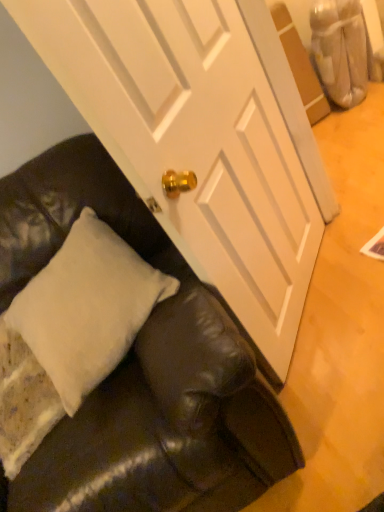
In order to face black leather couch at lower left, should I rotate leftwards or rightwards?

A 20.277 degree turn to the left will do.

Image resolution: width=384 pixels, height=512 pixels. Describe the element at coordinates (142, 368) in the screenshot. I see `black leather couch at lower left` at that location.

You are a GUI agent. You are given a task and a screenshot of the screen. Output one action in this format:
    pyautogui.click(x=<x>, y=<y>)
    Task: Click on the black leather couch at lower left
    This screenshot has height=512, width=384.
    Given the screenshot: What is the action you would take?
    pyautogui.click(x=142, y=368)

Measure the distance between point (69, 236) and camera.

A distance of 3.84 feet exists between point (69, 236) and camera.

The height and width of the screenshot is (512, 384). What do you see at coordinates (87, 308) in the screenshot?
I see `white soft pillow at lower left` at bounding box center [87, 308].

The width and height of the screenshot is (384, 512). I want to click on white soft pillow at lower left, so click(87, 308).

The height and width of the screenshot is (512, 384). Identify the location of black leather couch at lower left. 142,368.

Is black leather couch at lower left at the left side of white soft pillow at lower left?

No, black leather couch at lower left is not to the left of white soft pillow at lower left.

Considering the positions of objects black leather couch at lower left and white soft pillow at lower left in the image provided, who is in front, black leather couch at lower left or white soft pillow at lower left?

black leather couch at lower left is closer to the camera.

Which is in front, point (59, 186) or point (133, 304)?

Positioned in front is point (133, 304).

From the image's perspective, does black leather couch at lower left appear higher than white soft pillow at lower left?

No.

From a real-world perspective, is black leather couch at lower left located higher than white soft pillow at lower left?

Actually, black leather couch at lower left is physically below white soft pillow at lower left in the real world.

Between black leather couch at lower left and white soft pillow at lower left, which one has larger width?

Wider between the two is black leather couch at lower left.

Is black leather couch at lower left shorter than white soft pillow at lower left?

→ Incorrect, the height of black leather couch at lower left does not fall short of that of white soft pillow at lower left.

Who is smaller, black leather couch at lower left or white soft pillow at lower left?

Smaller between the two is white soft pillow at lower left.

Would you say black leather couch at lower left contains white soft pillow at lower left?

Yes, white soft pillow at lower left is surrounded by black leather couch at lower left.

Are black leather couch at lower left and white soft pillow at lower left far apart?

No.

Is black leather couch at lower left oriented away from white soft pillow at lower left?

Yes, black leather couch at lower left is positioned with its back facing white soft pillow at lower left.

At what (x,y) coordinates should I click in order to perform the action: click on studio couch in front of the white soft pillow at lower left. Please return your answer as a coordinate pair (x, y). Looking at the image, I should click on (142, 368).

Is white soft pillow at lower left to the left of black leather couch at lower left from the viewer's perspective?

Yes, white soft pillow at lower left is to the left of black leather couch at lower left.

Which is in front, white soft pillow at lower left or black leather couch at lower left?

black leather couch at lower left is closer to the camera.

Does point (135, 282) lie behind point (47, 485)?

Yes, it is behind point (47, 485).

From the image's perspective, does white soft pillow at lower left appear higher than black leather couch at lower left?

Yes, from the image's perspective, white soft pillow at lower left is over black leather couch at lower left.

From a real-world perspective, which object stands above the other?

In real-world perspective, white soft pillow at lower left is above.

Considering the relative sizes of white soft pillow at lower left and black leather couch at lower left in the image provided, is white soft pillow at lower left wider than black leather couch at lower left?

No.

Considering the relative sizes of white soft pillow at lower left and black leather couch at lower left in the image provided, is white soft pillow at lower left taller than black leather couch at lower left?

In fact, white soft pillow at lower left may be shorter than black leather couch at lower left.

From the picture: Is white soft pillow at lower left smaller than black leather couch at lower left?

Indeed, white soft pillow at lower left has a smaller size compared to black leather couch at lower left.

Is white soft pillow at lower left inside the boundaries of black leather couch at lower left, or outside?

white soft pillow at lower left fits inside black leather couch at lower left.

Is white soft pillow at lower left touching black leather couch at lower left?

No, white soft pillow at lower left is not touching black leather couch at lower left.

Is white soft pillow at lower left looking in the opposite direction of black leather couch at lower left?

Yes, white soft pillow at lower left is facing away from black leather couch at lower left.

What's the angular difference between white soft pillow at lower left and black leather couch at lower left's facing directions?

They differ by 35.1 degrees in their facing directions.

Locate an element on the screen. This screenshot has height=512, width=384. studio couch directly beneath the white soft pillow at lower left (from a real-world perspective) is located at coordinates (142, 368).

Locate an element on the screen. This screenshot has width=384, height=512. pillow lying behind the black leather couch at lower left is located at coordinates (87, 308).

Where is `pillow above the black leather couch at lower left (from a real-world perspective)`? pillow above the black leather couch at lower left (from a real-world perspective) is located at coordinates (87, 308).